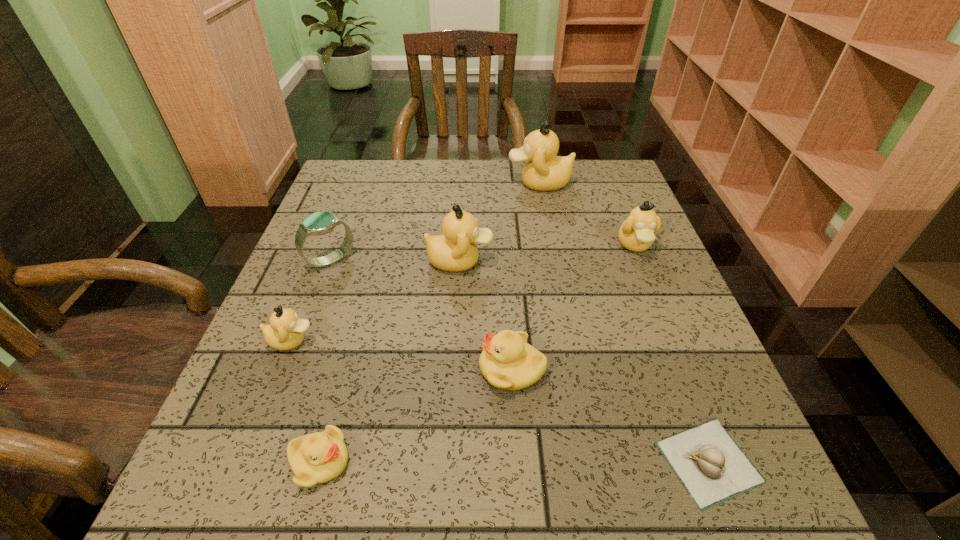
Where is `the right yellow duckling`? The image size is (960, 540). the right yellow duckling is located at coordinates [x=507, y=361].

The image size is (960, 540). I want to click on the left yellow duckling, so click(x=319, y=457).

Locate an element on the screen. the nearer yellow duckling is located at coordinates (319, 457).

The image size is (960, 540). I want to click on garlic, so click(x=711, y=466).

Identify the location of vacant space located on the face of the farthest object. The height and width of the screenshot is (540, 960). (425, 183).

Locate an element on the screen. Image resolution: width=960 pixels, height=540 pixels. vacant space located 0.180m on the face of the farthest object is located at coordinates (444, 183).

Where is `free region located 0.390m on the face of the farthest object`? This screenshot has height=540, width=960. free region located 0.390m on the face of the farthest object is located at coordinates (368, 183).

Where is `free space located 0.150m on the face of the seventh shortest object`? Image resolution: width=960 pixels, height=540 pixels. free space located 0.150m on the face of the seventh shortest object is located at coordinates (560, 261).

Identify the location of free space located on the face of the rightmost duckling. (660, 307).

Where is `vacant space located on the right of the blue watch`? Image resolution: width=960 pixels, height=540 pixels. vacant space located on the right of the blue watch is located at coordinates (377, 260).